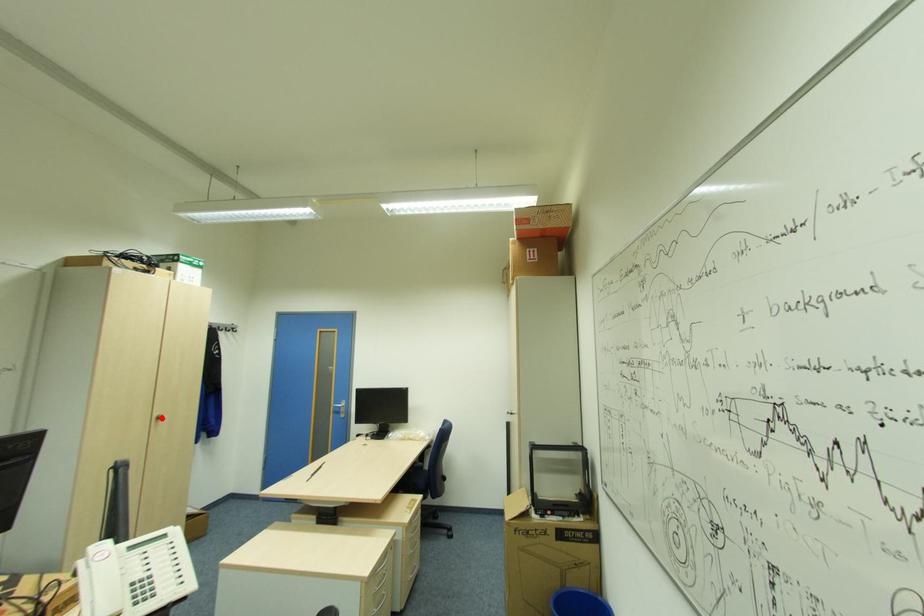
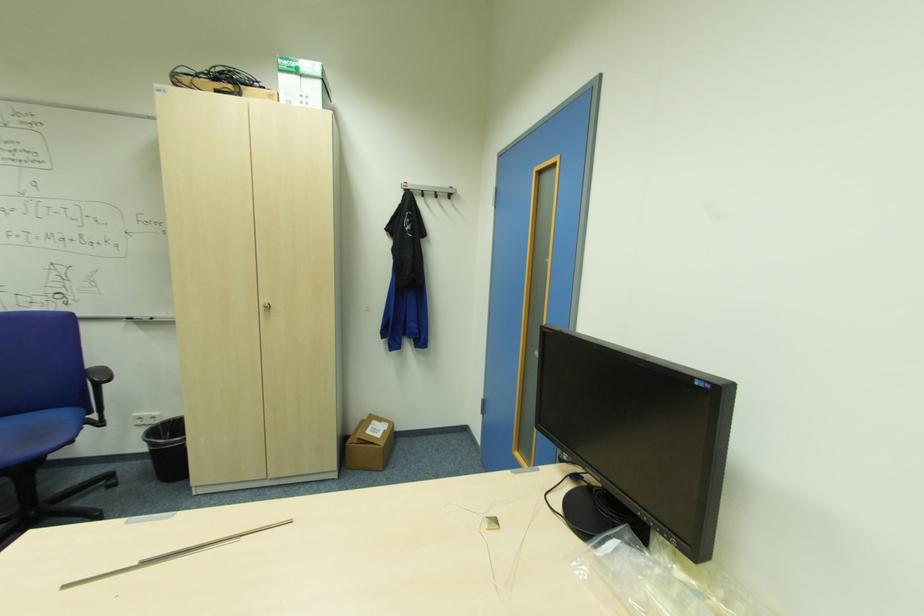
Where in the second image is the point corresponding to the highlighted location from the first image?

(271, 307)